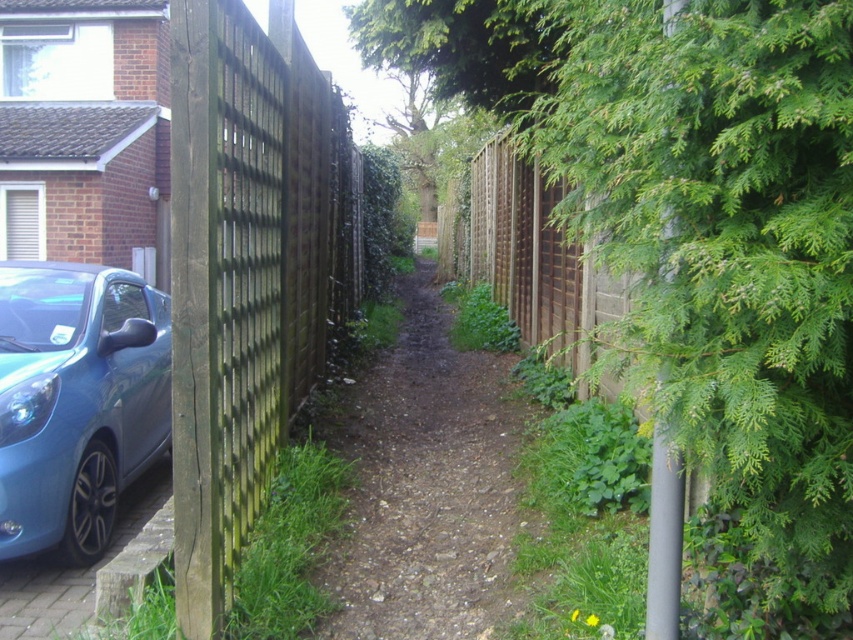
You are a delivery person trying to navigate a narrow alleyway. You see the green weathered wood fence at left and the metallic blue car at lower left. Which object is positioned higher relative to the other?

The green weathered wood fence at left is located above the metallic blue car at lower left, so it is positioned higher.

You are standing in the alley and want to take a photo of the green weathered wood fence at left. If your camera can focus on objects up to 6 meters away, will you be able to capture the fence clearly?

The green weathered wood fence at left is 6.70 meters from the camera, which is beyond the camera maximum focus range of 6 meters. Therefore, the fence will not be in focus and the photo will be blurry.